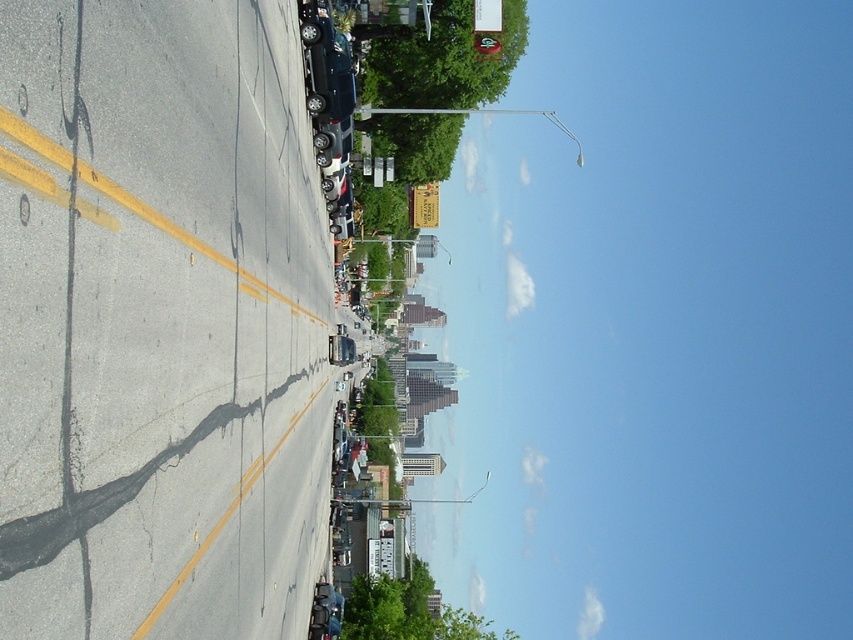
Question: Is asphalt at center positioned behind shiny silver car at center?

Choices:
 (A) yes
 (B) no

Answer: (B)

Question: Considering the relative positions of yellow asphalt road at left and satin black car at upper center in the image provided, where is yellow asphalt road at left located with respect to satin black car at upper center?

Choices:
 (A) below
 (B) above

Answer: (A)

Question: Which object appears closest to the camera in this image?

Choices:
 (A) yellow asphalt road at left
 (B) shiny silver car at center
 (C) cracked asphalt at center
 (D) asphalt at center

Answer: (D)

Question: Which point is closer to the camera?

Choices:
 (A) (337, 61)
 (B) (196, 243)

Answer: (B)

Question: Which of the following is the closest to the observer?

Choices:
 (A) click(x=315, y=154)
 (B) click(x=129, y=196)
 (C) click(x=245, y=486)
 (D) click(x=169, y=608)

Answer: (B)

Question: Is yellow asphalt road at left smaller than cracked asphalt at center?

Choices:
 (A) no
 (B) yes

Answer: (B)